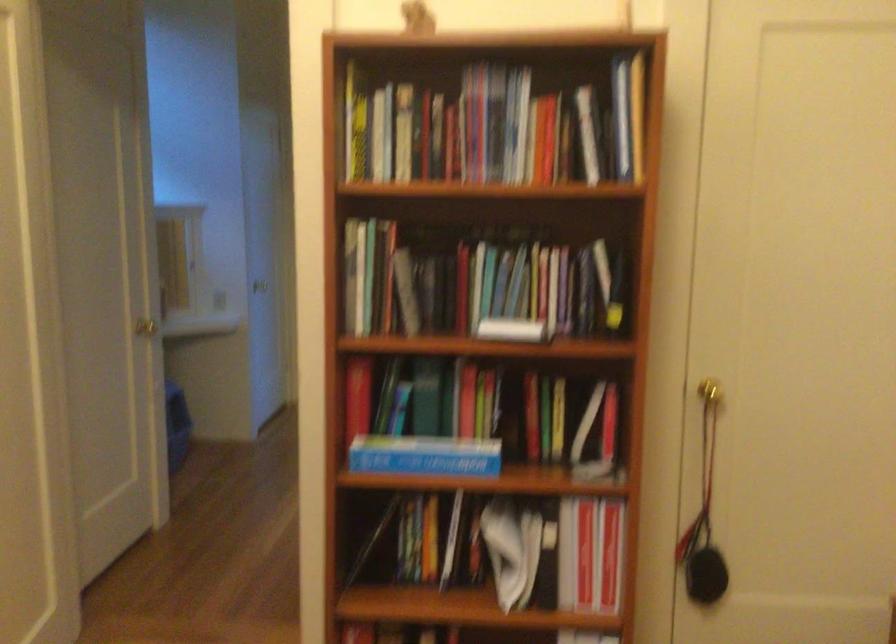
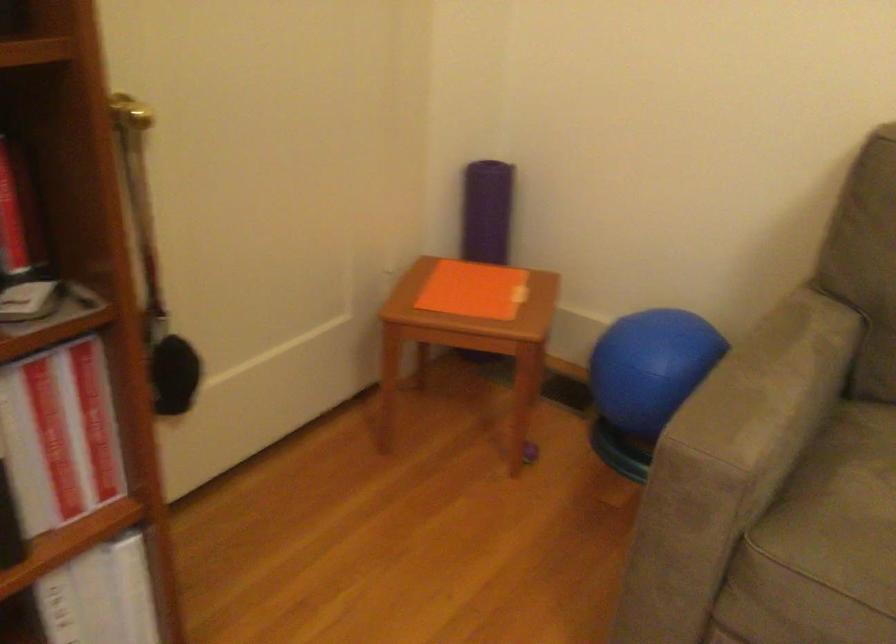
In the scene shown: Based on the continuous images, in which direction is the camera rotating?

The camera rotated toward right-down.